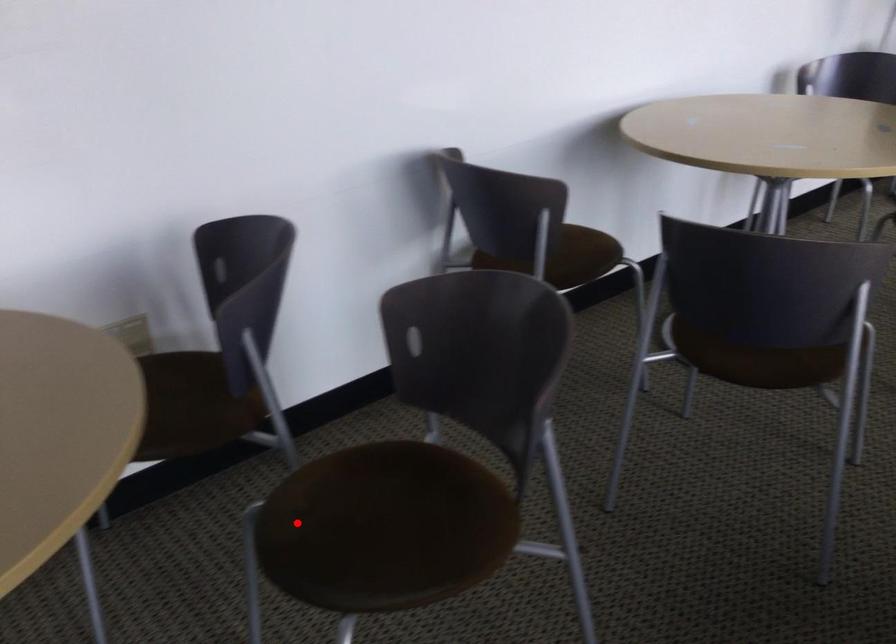
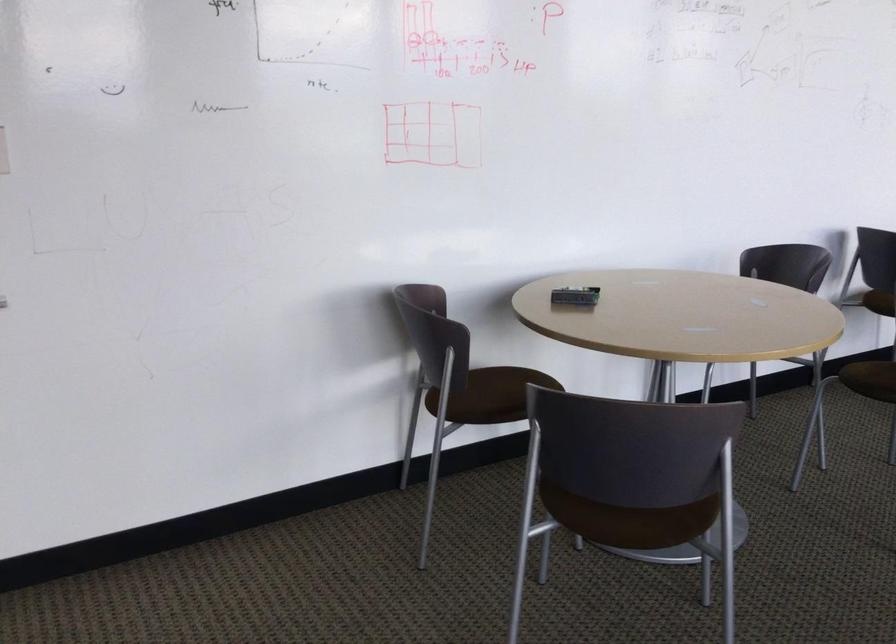
In the second image, find the point that corresponds to the highlighted location in the first image.

(872, 379)